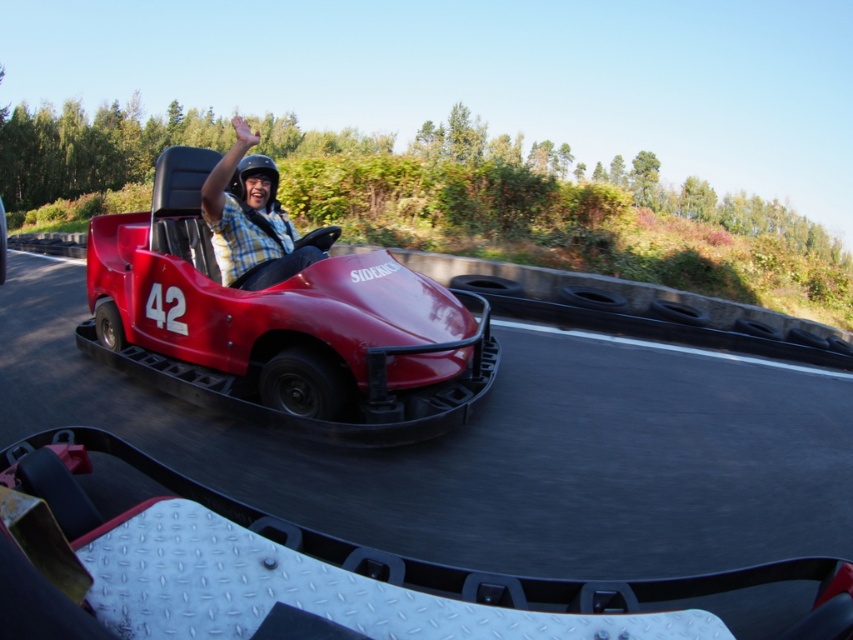
Question: Does shiny red go-kart at center appear over plaid shirt at center?

Choices:
 (A) yes
 (B) no

Answer: (B)

Question: Which point is farther to the camera?

Choices:
 (A) plaid shirt at center
 (B) shiny red go-kart at center
 (C) red rubber race track at center

Answer: (C)

Question: Can you confirm if shiny red go-kart at center is positioned above plaid shirt at center?

Choices:
 (A) no
 (B) yes

Answer: (A)

Question: Can you confirm if red rubber race track at center is thinner than shiny red go-kart at center?

Choices:
 (A) yes
 (B) no

Answer: (A)

Question: Based on their relative distances, which object is nearer to the shiny red go-kart at center?

Choices:
 (A) plaid shirt at center
 (B) red rubber race track at center

Answer: (A)

Question: Which point is farther to the camera?

Choices:
 (A) plaid shirt at center
 (B) red rubber race track at center

Answer: (B)